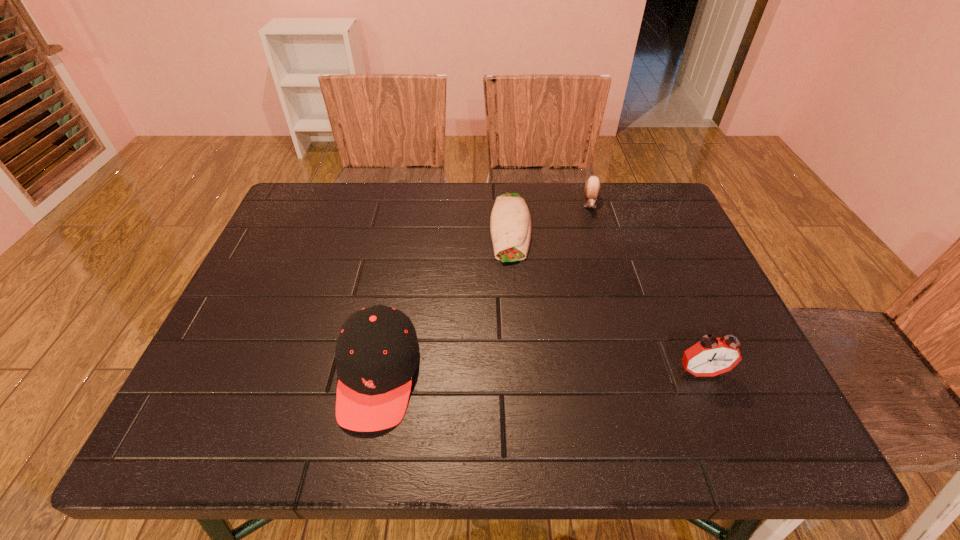
Locate an element on the screen. Image resolution: width=960 pixels, height=540 pixels. free location located 0.360m at the bitten end of the burrito is located at coordinates (514, 389).

You are a GUI agent. You are given a task and a screenshot of the screen. Output one action in this format:
    pyautogui.click(x=<x>, y=<y>)
    Task: Click on the vacant area situated 0.300m at the bitten end of the burrito
    The image size is (960, 540).
    Given the screenshot: What is the action you would take?
    pyautogui.click(x=514, y=363)

Image resolution: width=960 pixels, height=540 pixels. In order to click on escargot that is at the far edge in this screenshot , I will do [x=592, y=187].

The height and width of the screenshot is (540, 960). Identify the location of burrito that is at the far edge. (510, 223).

Find the location of a particular element. This screenshot has height=540, width=960. cap at the near edge is located at coordinates (377, 351).

I want to click on alarm clock located in the near edge section of the desktop, so click(711, 356).

I want to click on object located in the right edge section of the desktop, so click(711, 356).

You are a GUI agent. You are given a task and a screenshot of the screen. Output one action in this format:
    pyautogui.click(x=<x>, y=<y>)
    Task: Click on the object situated at the near right corner
    
    Given the screenshot: What is the action you would take?
    pyautogui.click(x=711, y=356)

Locate an element on the screen. vacant point at the far edge is located at coordinates (484, 221).

You are a GUI agent. You are given a task and a screenshot of the screen. Output one action in this format:
    pyautogui.click(x=<x>, y=<y>)
    Task: Click on the free space at the near edge
    
    Given the screenshot: What is the action you would take?
    pyautogui.click(x=636, y=402)